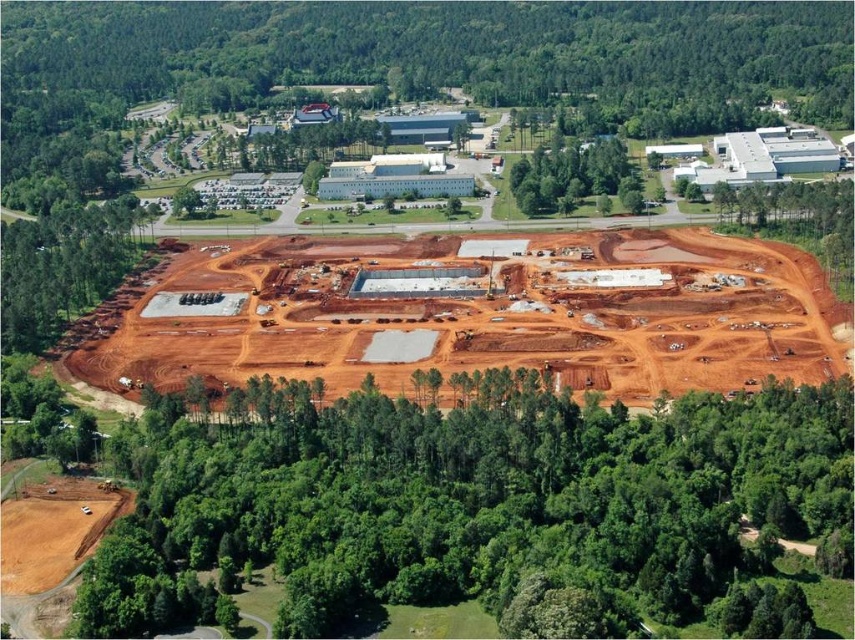
Does green leafy trees at lower center have a smaller size compared to green leafy tree at upper center?

No, green leafy trees at lower center is not smaller than green leafy tree at upper center.

Between green leafy trees at lower center and green leafy tree at upper center, which one is positioned higher?

Positioned higher is green leafy tree at upper center.

Between point (559, 616) and point (519, 161), which one is positioned in front?

Point (559, 616) is in front.

Locate an element on the screen. green leafy trees at lower center is located at coordinates (475, 509).

Is point (134, 342) less distant than point (596, 173)?

Yes, point (134, 342) is closer to viewer.

Does reddish-brown dirt field at center have a lesser height compared to green leafy tree at upper center?

No, reddish-brown dirt field at center is not shorter than green leafy tree at upper center.

Does point (490, 353) come in front of point (559, 184)?

Yes, it is in front of point (559, 184).

At what (x,y) coordinates should I click in order to perform the action: click on reddish-brown dirt field at center. Please return your answer as a coordinate pair (x, y). This screenshot has height=640, width=855. Looking at the image, I should click on (492, 317).

Does green leafy trees at lower center have a lesser width compared to reddish-brown dirt field at center?

Correct, green leafy trees at lower center's width is less than reddish-brown dirt field at center's.

I want to click on green leafy trees at lower center, so click(x=475, y=509).